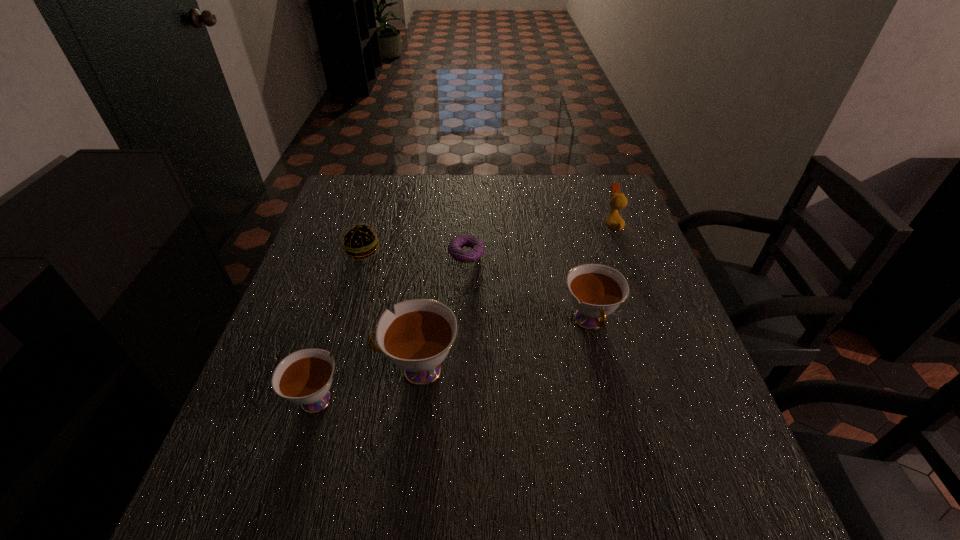
Identify the location of vacant space at the right edge of the desktop. The width and height of the screenshot is (960, 540). (626, 278).

I want to click on blank space at the far left corner, so click(375, 194).

This screenshot has width=960, height=540. In the image, there is a desktop. In order to click on vacant region at the near left corner in this screenshot , I will do `click(292, 442)`.

In the image, there is a desktop. Identify the location of vacant space at the far right corner. This screenshot has height=540, width=960. (592, 179).

Identify the location of vacant space that is in between the rightmost teacup and the patty. The image size is (960, 540). (476, 287).

You are a GUI agent. You are given a task and a screenshot of the screen. Output one action in this format:
    pyautogui.click(x=<x>, y=<y>)
    Task: Click on the free spot between the second shortest object and the shortest object
    The width and height of the screenshot is (960, 540).
    Given the screenshot: What is the action you would take?
    pyautogui.click(x=414, y=253)

What are the coordinates of `vacant region between the rightmost teacup and the doughnut` in the screenshot? It's located at (528, 288).

Identify the location of blank region between the leftmost teacup and the second teacup from right to left. (368, 383).

Find the location of a particular element. Image resolution: width=960 pixels, height=540 pixels. empty space between the shortest teacup and the rightmost teacup is located at coordinates (453, 360).

Image resolution: width=960 pixels, height=540 pixels. What are the coordinates of `vacant space that is in between the farthest object and the patty` in the screenshot? It's located at (488, 239).